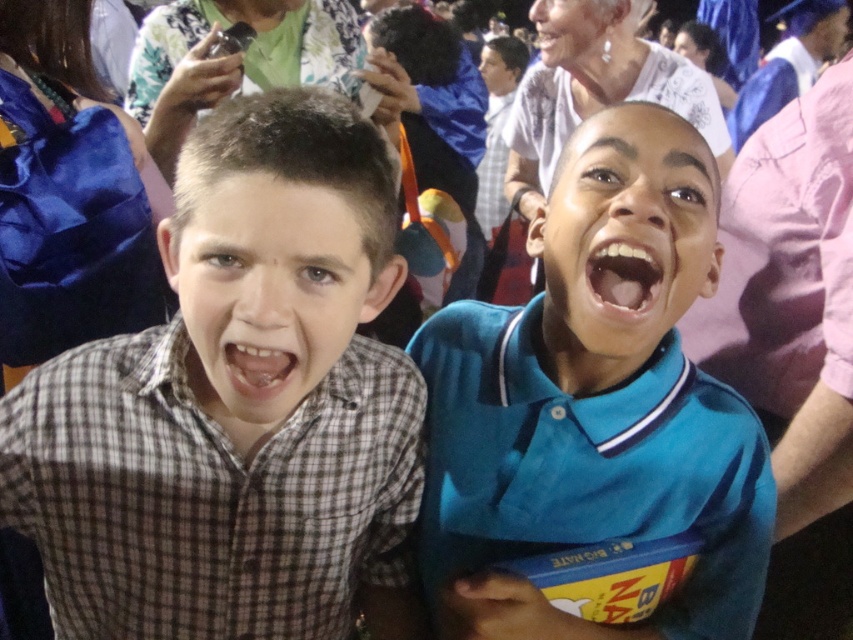
Question: Which of the following is the closest to the observer?

Choices:
 (A) checkered fabric face at center
 (B) brown checkered shirt at left
 (C) blue matte shirt at center

Answer: (A)

Question: Does checkered fabric face at center come in front of matte white face at upper center?

Choices:
 (A) yes
 (B) no

Answer: (A)

Question: Can you confirm if teal polo shirt at center is thinner than blue matte shirt at center?

Choices:
 (A) yes
 (B) no

Answer: (B)

Question: Which object appears closest to the camera in this image?

Choices:
 (A) brown checkered shirt at left
 (B) blue matte shirt at center
 (C) checkered fabric face at center

Answer: (C)

Question: Is brown checkered shirt at left closer to the viewer compared to blue matte shirt at center?

Choices:
 (A) no
 (B) yes

Answer: (B)

Question: Which object is positioned farthest from the blue matte shirt at center?

Choices:
 (A) matte white face at upper center
 (B) teal polo shirt at center

Answer: (A)